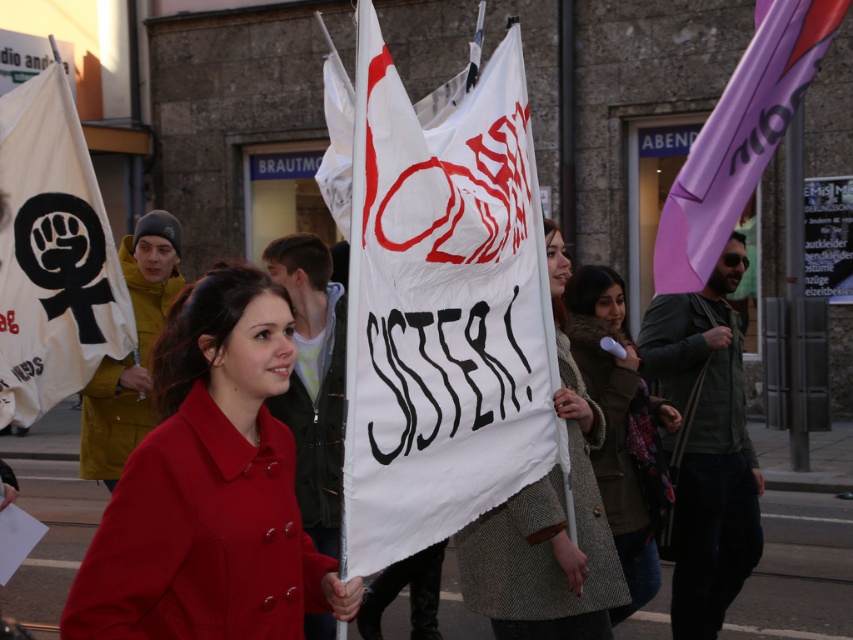
You are organizing a protest and need to choose between the white woolen coat at center and the cozy woolen coat at center. Which one would you pick if you want to stand out more visually?

The white woolen coat at center is bigger than the cozy woolen coat at center, so it would stand out more visually.

You are a photographer at the protest scene. You want to capture a photo where both the white paper banner at center and the cozy woolen coat at center are clearly visible. Since the banner is larger, will it block the view of the coat in your photo?

The white paper banner at center is larger in size than the cozy woolen coat at center. Since the banner is positioned in front of the coat, it might block part of the coat in the photo.

You are a photographer trying to capture the protest scene. You notice a point at coordinates [548,524] in the image. What object is located at this point?

The point at coordinates [548,524] corresponds to the white woolen coat at center.